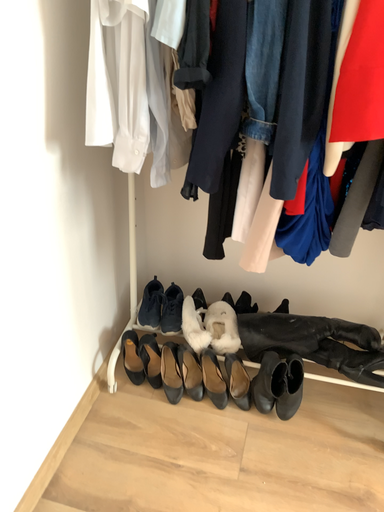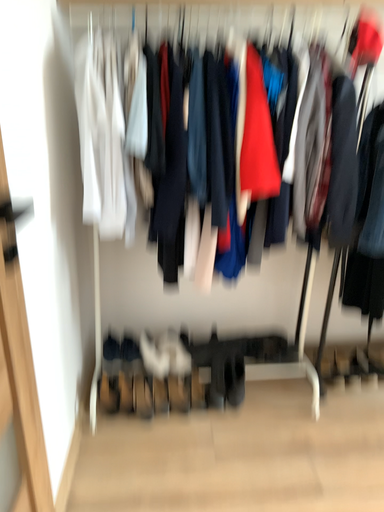
Question: How did the camera likely rotate when shooting the video?

Choices:
 (A) rotated upward
 (B) rotated downward

Answer: (A)